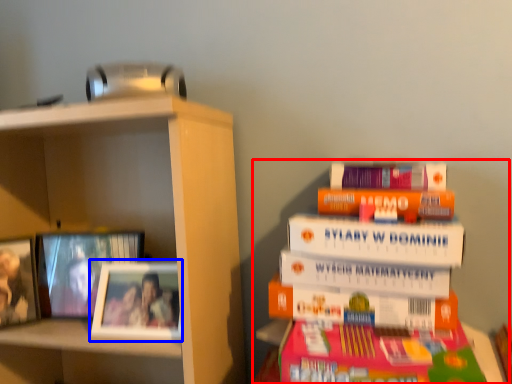
Question: Which object appears farthest to the camera in this image, book (highlighted by a red box) or picture frame (highlighted by a blue box)?

Choices:
 (A) book
 (B) picture frame

Answer: (B)